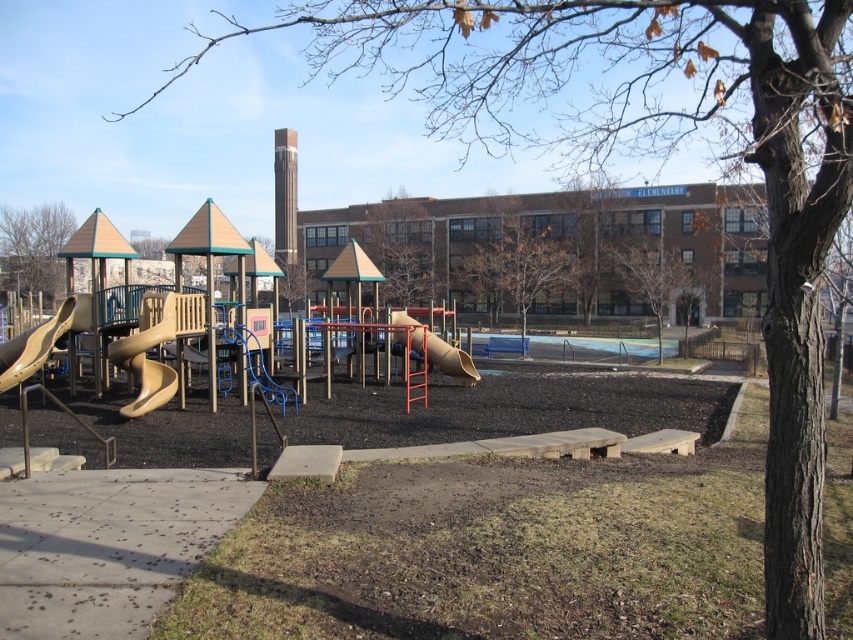
Question: Which point appears farthest from the camera in this image?

Choices:
 (A) (39, 262)
 (B) (151, 392)

Answer: (A)

Question: Is brown leafless tree at center closer to the viewer compared to brown bark tree at upper left?

Choices:
 (A) no
 (B) yes

Answer: (A)

Question: Among these points, which one is farthest from the camera?

Choices:
 (A) (633, 266)
 (B) (165, 369)
 (C) (62, 273)

Answer: (C)

Question: Can you confirm if matte yellow slide at left is bigger than matte yellow slide at center-left?

Choices:
 (A) no
 (B) yes

Answer: (B)

Question: Which point appears farthest from the camera in this image?

Choices:
 (A) (679, 260)
 (B) (4, 381)
 (C) (381, 205)

Answer: (C)

Question: From the image, what is the correct spatial relationship of brown leafless tree at center in relation to matte yellow slide at center-left?

Choices:
 (A) above
 (B) below

Answer: (A)